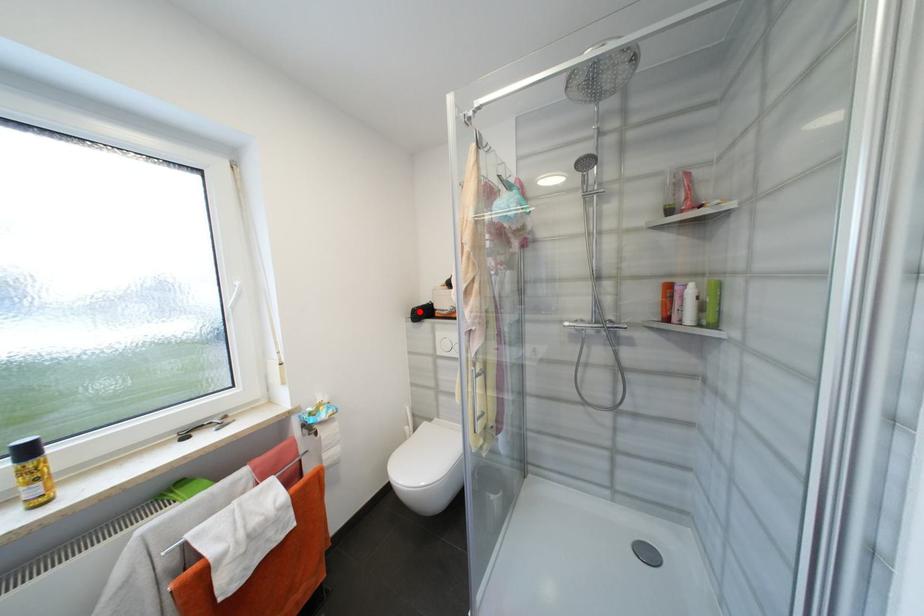
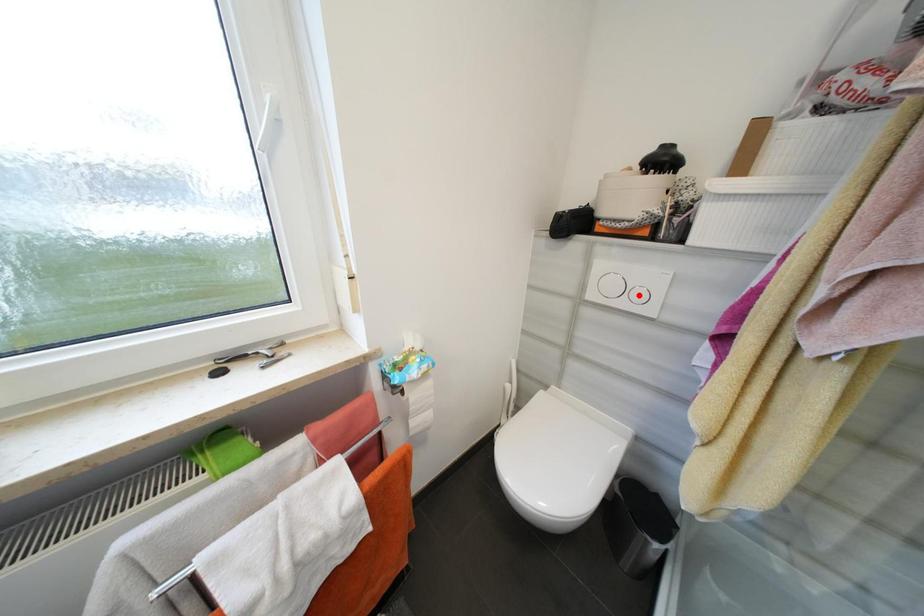
I am providing you with two images of the same scene from different viewpoints. A red point is marked on the first image and another point is marked on the second image. Do the highlighted points in image1 and image2 indicate the same real-world spot?

No